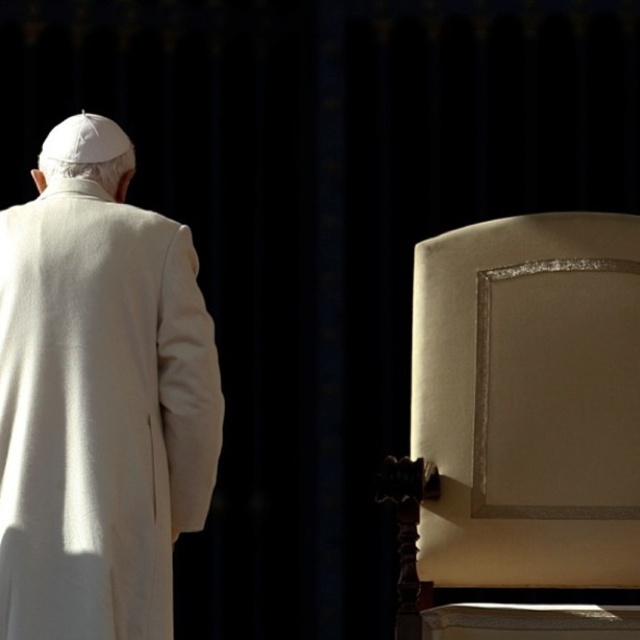
Does point (419, 586) come in front of point (36, 406)?

No, (419, 586) is further to viewer.

Find the location of a particular element. satin beige chair at right is located at coordinates (522, 426).

The height and width of the screenshot is (640, 640). What do you see at coordinates (522, 426) in the screenshot?
I see `satin beige chair at right` at bounding box center [522, 426].

Find the location of a particular element. This screenshot has width=640, height=640. satin beige chair at right is located at coordinates [522, 426].